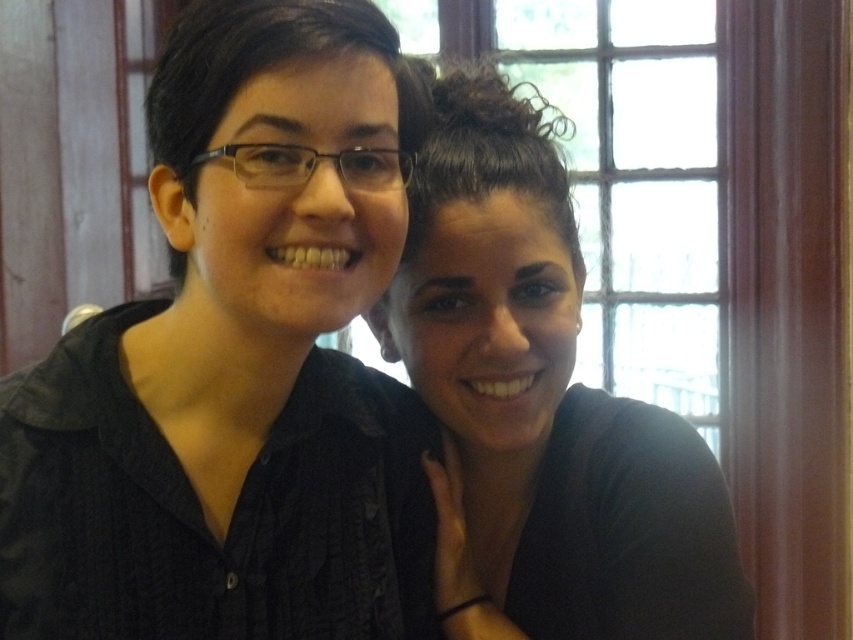
Question: Among these objects, which one is farthest from the camera?

Choices:
 (A) black matte shirt at center
 (B) matte black shirt at center

Answer: (B)

Question: Does black matte shirt at center appear on the right side of matte black shirt at center?

Choices:
 (A) yes
 (B) no

Answer: (B)

Question: Which object is closer to the camera taking this photo?

Choices:
 (A) matte black shirt at center
 (B) black matte shirt at center

Answer: (B)

Question: Is black matte shirt at center above matte black shirt at center?

Choices:
 (A) no
 (B) yes

Answer: (B)

Question: Is black matte shirt at center smaller than matte black shirt at center?

Choices:
 (A) yes
 (B) no

Answer: (B)